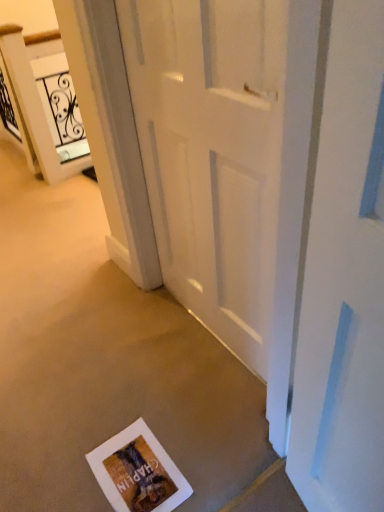
Question: Does white glossy elevator at upper left turn towards white matte door at center?

Choices:
 (A) yes
 (B) no

Answer: (A)

Question: From a real-world perspective, is white glossy elevator at upper left on white matte door at center?

Choices:
 (A) yes
 (B) no

Answer: (B)

Question: Is white glossy elevator at upper left oriented away from white matte door at center?

Choices:
 (A) no
 (B) yes

Answer: (A)

Question: From the image's perspective, is white glossy elevator at upper left on white matte door at center?

Choices:
 (A) no
 (B) yes

Answer: (B)

Question: Considering the relative positions of white glossy elevator at upper left and white matte door at center in the image provided, is white glossy elevator at upper left in front of white matte door at center?

Choices:
 (A) no
 (B) yes

Answer: (A)

Question: Considering the positions of white glossy elevator at upper left and white matte door at center in the image, is white glossy elevator at upper left taller or shorter than white matte door at center?

Choices:
 (A) tall
 (B) short

Answer: (B)

Question: From a real-world perspective, is white glossy elevator at upper left above or below white matte door at center?

Choices:
 (A) above
 (B) below

Answer: (B)

Question: Is white glossy elevator at upper left in front of or behind white matte door at center in the image?

Choices:
 (A) front
 (B) behind

Answer: (B)

Question: In terms of width, does white glossy elevator at upper left look wider or thinner when compared to white matte door at center?

Choices:
 (A) wide
 (B) thin

Answer: (A)

Question: Relative to white matte door at center, is matte paper postcard at lower center in front or behind?

Choices:
 (A) behind
 (B) front

Answer: (A)

Question: Looking at the image, does matte paper postcard at lower center seem bigger or smaller compared to white matte door at center?

Choices:
 (A) big
 (B) small

Answer: (B)

Question: Considering the relative positions of matte paper postcard at lower center and white matte door at center in the image provided, is matte paper postcard at lower center to the left or to the right of white matte door at center?

Choices:
 (A) right
 (B) left

Answer: (B)

Question: Considering the positions of point (157, 498) and point (248, 211), is point (157, 498) closer or farther from the camera than point (248, 211)?

Choices:
 (A) closer
 (B) farther

Answer: (B)

Question: Considering their positions, is white matte door at center located in front of or behind matte paper postcard at lower center?

Choices:
 (A) front
 (B) behind

Answer: (A)

Question: Is white matte door at center situated inside matte paper postcard at lower center or outside?

Choices:
 (A) outside
 (B) inside

Answer: (A)